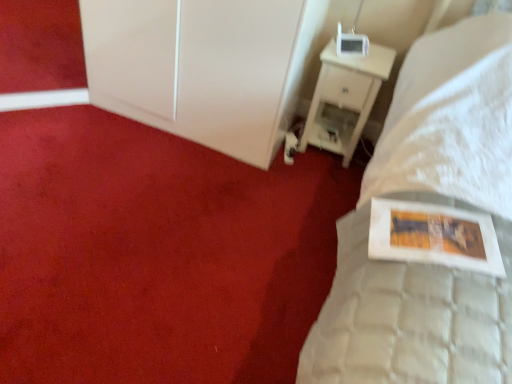
This screenshot has height=384, width=512. What are the coordinates of `white glossy cabinet at upper left` in the screenshot? It's located at (196, 68).

Where is `white wood nightstand at upper right`? This screenshot has width=512, height=384. white wood nightstand at upper right is located at coordinates (345, 98).

Does point (93, 16) come farther from viewer compared to point (170, 244)?

That is True.

From the image's perspective, which one is positioned lower, white glossy cabinet at upper left or white glossy picture frame at upper right?

From the image's view, white glossy picture frame at upper right is below.

Locate an element on the screen. This screenshot has height=384, width=512. dresser above the white glossy picture frame at upper right (from a real-world perspective) is located at coordinates [x=196, y=68].

Are white glossy cabinet at upper left and white glossy picture frame at upper right making contact?

No, white glossy cabinet at upper left is not with white glossy picture frame at upper right.

Is white wood nightstand at upper right spatially inside white glossy picture frame at upper right, or outside of it?

white wood nightstand at upper right is not inside white glossy picture frame at upper right, it's outside.

From the picture: Does white wood nightstand at upper right have a smaller size compared to white glossy picture frame at upper right?

Yes.

Is white wood nightstand at upper right touching white glossy picture frame at upper right?

They are not placed beside each other.

Is white glossy picture frame at upper right facing towards white wood nightstand at upper right?

No, white glossy picture frame at upper right is not aimed at white wood nightstand at upper right.

Is point (21, 276) more distant than point (373, 84)?

No, (21, 276) is in front of (373, 84).

Is white glossy picture frame at upper right located outside white wood nightstand at upper right?

Yes, white glossy picture frame at upper right is located beyond the bounds of white wood nightstand at upper right.

Is white wood nightstand at upper right surrounding white glossy cabinet at upper left?

No, white wood nightstand at upper right does not contain white glossy cabinet at upper left.

Between white wood nightstand at upper right and white glossy cabinet at upper left, which one is positioned behind?

white wood nightstand at upper right is behind.

Is white wood nightstand at upper right oriented away from white glossy cabinet at upper left?

No, white wood nightstand at upper right is not facing the opposite direction of white glossy cabinet at upper left.

Is point (248, 83) positioned in front of point (351, 72)?

Yes, point (248, 83) is in front of point (351, 72).

Based on their positions, is white glossy cabinet at upper left located to the left or right of white wood nightstand at upper right?

In the image, white glossy cabinet at upper left appears on the left side of white wood nightstand at upper right.

Locate an element on the screen. Image resolution: width=512 pixels, height=384 pixels. dresser located above the white wood nightstand at upper right (from the image's perspective) is located at coordinates (196, 68).

Which object is further away from the camera, white glossy picture frame at upper right or white glossy cabinet at upper left?

white glossy cabinet at upper left.

Between point (133, 369) and point (272, 58), which one is positioned behind?

Point (272, 58)

How different are the orientations of white glossy picture frame at upper right and white glossy cabinet at upper left in degrees?

The angle between the facing direction of white glossy picture frame at upper right and the facing direction of white glossy cabinet at upper left is 90.3 degrees.

Can you confirm if white glossy picture frame at upper right is taller than white glossy cabinet at upper left?

No.

Where is `dresser behind the white glossy picture frame at upper right`? This screenshot has width=512, height=384. dresser behind the white glossy picture frame at upper right is located at coordinates (196, 68).

Locate an element on the screen. The width and height of the screenshot is (512, 384). nightstand positioned vertically above the white glossy picture frame at upper right (from a real-world perspective) is located at coordinates (345, 98).

Considering their positions, is white wood nightstand at upper right positioned further to white glossy cabinet at upper left than white glossy picture frame at upper right?

Among the two, white glossy picture frame at upper right is located further to white glossy cabinet at upper left.

Estimate the real-world distances between objects in this image. Which object is closer to white wood nightstand at upper right, white glossy cabinet at upper left or white glossy picture frame at upper right?

The object closer to white wood nightstand at upper right is white glossy cabinet at upper left.

Considering their positions, is white glossy picture frame at upper right positioned closer to white glossy cabinet at upper left than white wood nightstand at upper right?

white wood nightstand at upper right lies closer to white glossy cabinet at upper left than the other object.

From the image, which object appears to be nearer to white wood nightstand at upper right, white glossy picture frame at upper right or white glossy cabinet at upper left?

The object closer to white wood nightstand at upper right is white glossy cabinet at upper left.

Looking at this image, which object lies nearer to the anchor point white glossy picture frame at upper right, white glossy cabinet at upper left or white wood nightstand at upper right?

white glossy cabinet at upper left is positioned closer to the anchor white glossy picture frame at upper right.

Estimate the real-world distances between objects in this image. Which object is further from white glossy picture frame at upper right, white wood nightstand at upper right or white glossy cabinet at upper left?

white wood nightstand at upper right.

I want to click on dresser between white glossy picture frame at upper right and white wood nightstand at upper right, so click(196, 68).